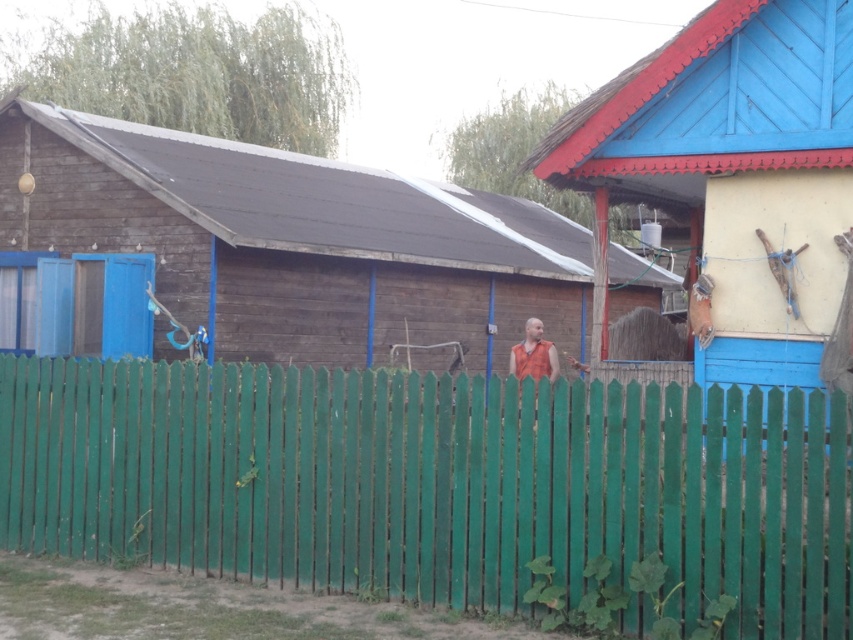
Does point (32, 145) come closer to viewer compared to point (538, 324)?

No, it is behind (538, 324).

Is wooden hut at center taller than orange fabric vest at center?

Indeed, wooden hut at center has a greater height compared to orange fabric vest at center.

Who is more distant from viewer, (x=170, y=134) or (x=555, y=356)?

Point (x=170, y=134)

Where is `wooden hut at center`? This screenshot has width=853, height=640. wooden hut at center is located at coordinates (293, 241).

Which of these two, green wooden fence at center or orange fabric vest at center, stands taller?

With more height is green wooden fence at center.

Does green wooden fence at center have a greater width compared to orange fabric vest at center?

Indeed, green wooden fence at center has a greater width compared to orange fabric vest at center.

Is point (405, 541) less distant than point (534, 378)?

Yes, point (405, 541) is in front of point (534, 378).

Identify the location of green wooden fence at center. The width and height of the screenshot is (853, 640). pos(436,483).

Can you confirm if green wooden fence at center is thinner than blue wooden hut at right?

No, green wooden fence at center is not thinner than blue wooden hut at right.

Looking at this image, does green wooden fence at center have a greater height compared to blue wooden hut at right?

Yes, green wooden fence at center is taller than blue wooden hut at right.

Does point (793, 403) come closer to viewer compared to point (825, 113)?

Yes, it is.

Where is `green wooden fence at center`? The height and width of the screenshot is (640, 853). green wooden fence at center is located at coordinates (436, 483).